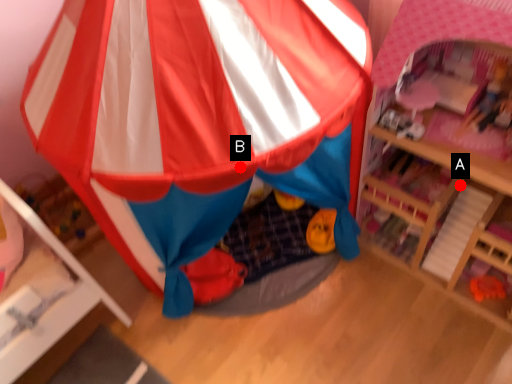
Question: Two points are circled on the image, labeled by A and B beside each circle. Which point appears closest to the camera in this image?

Choices:
 (A) A is closer
 (B) B is closer

Answer: (B)